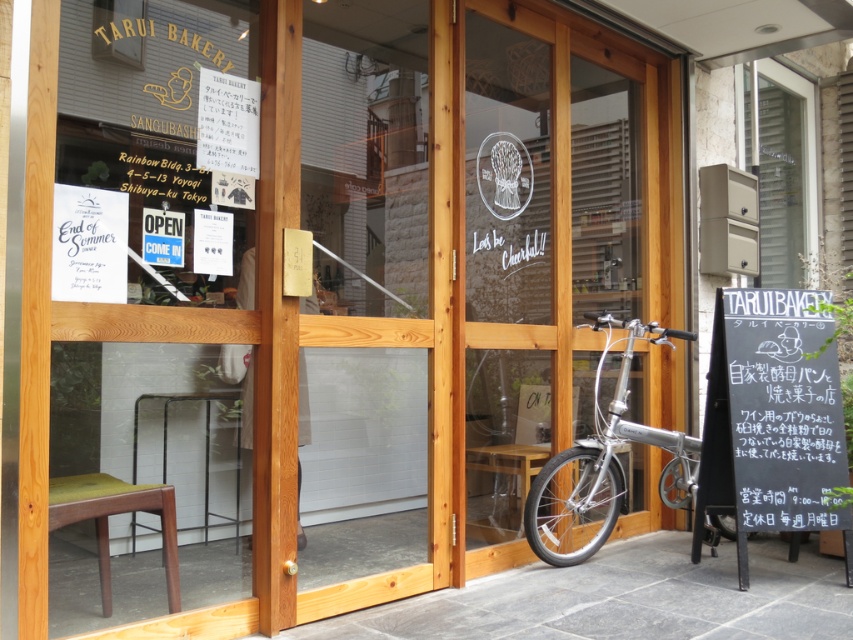
Question: Can you confirm if silver metallic bicycle at center is thinner than clear glass mailbox at upper right?

Choices:
 (A) yes
 (B) no

Answer: (B)

Question: Is wooden chair at lower left smaller than clear glass mailbox at upper right?

Choices:
 (A) yes
 (B) no

Answer: (B)

Question: Among these objects, which one is nearest to the camera?

Choices:
 (A) green velvet stool at lower left
 (B) silver metallic bicycle at center
 (C) transparent glass door at center

Answer: (A)

Question: Which of the following is the closest to the observer?

Choices:
 (A) silver metallic bicycle at center
 (B) green velvet stool at lower left
 (C) wooden chair at lower left
 (D) clear glass mailbox at upper right

Answer: (C)

Question: Among these objects, which one is farthest from the camera?

Choices:
 (A) wooden chair at lower left
 (B) silver metallic bicycle at center
 (C) green velvet stool at lower left
 (D) black chalkboard at right

Answer: (B)

Question: Can you confirm if wooden chair at lower left is positioned to the right of clear glass mailbox at upper right?

Choices:
 (A) no
 (B) yes

Answer: (A)